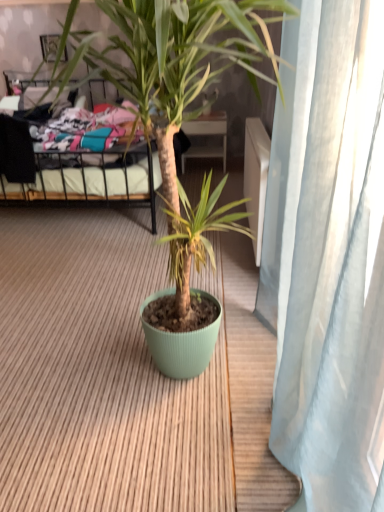
Describe the element at coordinates (49, 46) in the screenshot. I see `matte black picture frame at upper left` at that location.

Image resolution: width=384 pixels, height=512 pixels. What are the coordinates of `matte black picture frame at upper left` in the screenshot? It's located at (49, 46).

You are a GUI agent. You are given a task and a screenshot of the screen. Output one action in this format:
    pyautogui.click(x=<x>, y=<y>)
    Task: Click on the metallic black bed at upper left
    
    Given the screenshot: What is the action you would take?
    87,170

From the image's perspective, would you say matte black picture frame at upper left is positioned over matte green pot at center?

Yes, from the image's perspective, matte black picture frame at upper left is over matte green pot at center.

From a real-world perspective, between matte black picture frame at upper left and matte green pot at center, who is vertically higher?

matte black picture frame at upper left is physically above.

Does matte black picture frame at upper left appear on the right side of matte green pot at center?

No, matte black picture frame at upper left is not to the right of matte green pot at center.

Can you confirm if matte black picture frame at upper left is taller than matte green pot at center?

Incorrect, the height of matte black picture frame at upper left is not larger of that of matte green pot at center.

From the image's perspective, relative to matte black picture frame at upper left, is matte green pot at center above or below?

matte green pot at center is below matte black picture frame at upper left.

Does matte green pot at center appear on the left side of matte black picture frame at upper left?

Incorrect, matte green pot at center is not on the left side of matte black picture frame at upper left.

Between matte green pot at center and matte black picture frame at upper left, which one has smaller size?

With smaller size is matte black picture frame at upper left.

From a real-world perspective, is matte green pot at center positioned above or below metallic black bed at upper left?

In terms of real-world spatial position, matte green pot at center is above metallic black bed at upper left.

From the image's perspective, which one is positioned lower, matte green pot at center or metallic black bed at upper left?

matte green pot at center appears lower in the image.

In the scene shown: Could you tell me if matte green pot at center is facing metallic black bed at upper left?

No, matte green pot at center is not aimed at metallic black bed at upper left.

I want to click on houseplant lying on the right of metallic black bed at upper left, so click(173, 59).

Considering the sizes of objects metallic black bed at upper left and matte green pot at center in the image provided, who is taller, metallic black bed at upper left or matte green pot at center?

With more height is matte green pot at center.

Looking at their sizes, would you say metallic black bed at upper left is wider or thinner than matte green pot at center?

metallic black bed at upper left is wider than matte green pot at center.

From a real-world perspective, is metallic black bed at upper left physically above matte green pot at center?

No, from a real-world perspective, metallic black bed at upper left is not on top of matte green pot at center.

Which is less distant, (13, 192) or (170, 86)?

The point (170, 86) is in front.

Which is behind, matte black picture frame at upper left or metallic black bed at upper left?

matte black picture frame at upper left.

Between matte black picture frame at upper left and metallic black bed at upper left, which one has smaller width?

matte black picture frame at upper left is thinner.

Considering the sizes of objects matte black picture frame at upper left and metallic black bed at upper left in the image provided, who is shorter, matte black picture frame at upper left or metallic black bed at upper left?

With less height is matte black picture frame at upper left.

Is metallic black bed at upper left further to the viewer compared to matte black picture frame at upper left?

No, it is not.

From the image's perspective, which one is positioned higher, metallic black bed at upper left or matte black picture frame at upper left?

matte black picture frame at upper left appears higher in the image.

How many degrees apart are the facing directions of metallic black bed at upper left and matte black picture frame at upper left?

They differ by 0.653 degrees in their facing directions.

Identify the location of picture frame behind the matte green pot at center. (49, 46).

This screenshot has height=512, width=384. Identify the location of houseplant lying in front of the matte black picture frame at upper left. (173, 59).

Based on their spatial positions, is matte black picture frame at upper left or metallic black bed at upper left further from matte green pot at center?

The object further to matte green pot at center is metallic black bed at upper left.

From the image, which object appears to be nearer to matte black picture frame at upper left, matte green pot at center or metallic black bed at upper left?

metallic black bed at upper left lies closer to matte black picture frame at upper left than the other object.

When comparing their distances from metallic black bed at upper left, does matte green pot at center or matte black picture frame at upper left seem further?

The object further to metallic black bed at upper left is matte green pot at center.

Consider the image. Estimate the real-world distances between objects in this image. Which object is further from metallic black bed at upper left, matte black picture frame at upper left or matte green pot at center?

matte green pot at center lies further to metallic black bed at upper left than the other object.

From the image, which object appears to be nearer to matte black picture frame at upper left, metallic black bed at upper left or matte green pot at center?

metallic black bed at upper left.

Looking at the image, which one is located further to matte green pot at center, metallic black bed at upper left or matte black picture frame at upper left?

The object further to matte green pot at center is metallic black bed at upper left.

Identify the location of bed located between matte green pot at center and matte black picture frame at upper left in the depth direction. (87, 170).